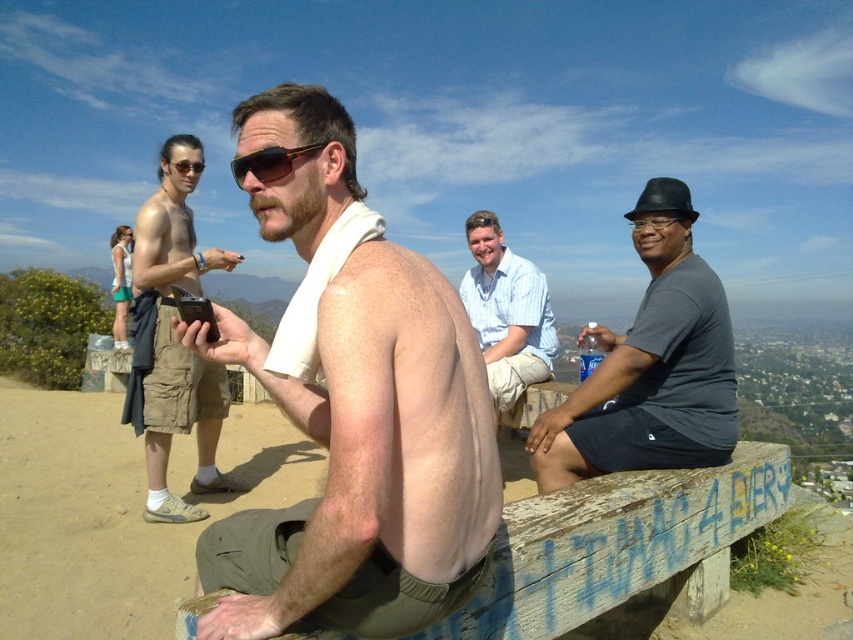
Question: Does shiny skin torso at center appear on the left side of tan cargo shorts at left?

Choices:
 (A) no
 (B) yes

Answer: (A)

Question: Which point is closer to the camera?

Choices:
 (A) dark gray t-shirt at right
 (B) shiny skin torso at center

Answer: (B)

Question: Is dark gray t-shirt at right below tan cargo shorts at left?

Choices:
 (A) yes
 (B) no

Answer: (B)

Question: Estimate the real-world distances between objects in this image. Which object is farther from the dark gray t-shirt at right?

Choices:
 (A) shiny skin torso at center
 (B) tan cargo shorts at left
 (C) light blue striped shirt at center

Answer: (B)

Question: Does dark gray t-shirt at right appear under light blue striped shirt at center?

Choices:
 (A) yes
 (B) no

Answer: (A)

Question: Which point is closer to the camera taking this photo?

Choices:
 (A) (215, 436)
 (B) (425, 300)
 (C) (509, 250)

Answer: (B)